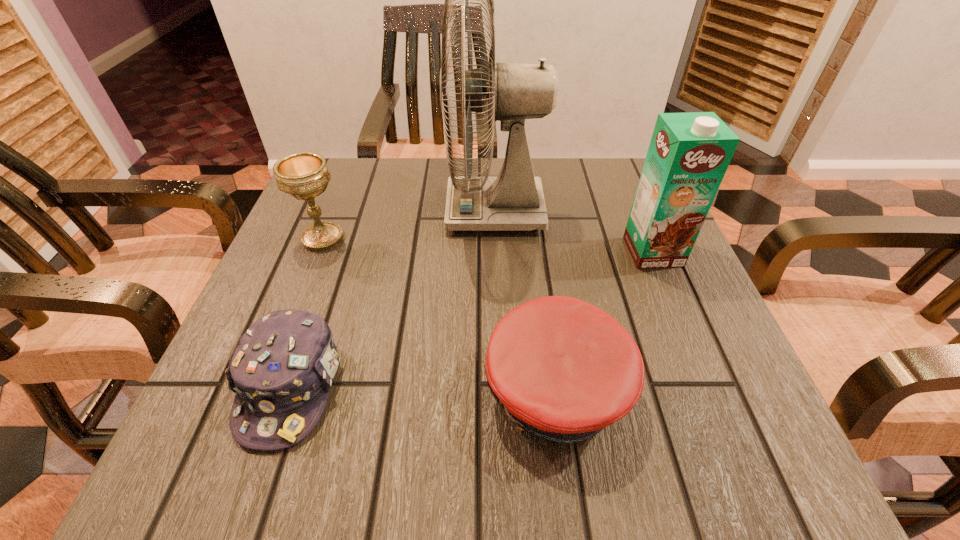
Locate an element on the screen. vacant space located 0.070m on the right of the third tallest object is located at coordinates (382, 238).

I want to click on free space located on the front-facing side of the right headwear, so click(x=275, y=390).

I want to click on vacant area situated on the front-facing side of the right headwear, so click(288, 390).

Where is `vacant space located 0.230m on the front-facing side of the right headwear`? Image resolution: width=960 pixels, height=540 pixels. vacant space located 0.230m on the front-facing side of the right headwear is located at coordinates (328, 390).

Image resolution: width=960 pixels, height=540 pixels. Identify the location of object that is positioned at the far edge. (513, 201).

Identify the location of chalice present at the left edge. Image resolution: width=960 pixels, height=540 pixels. (303, 175).

At what (x,y) coordinates should I click in order to perform the action: click on headwear that is at the left edge. Please return your answer as a coordinate pair (x, y). Looking at the image, I should click on (281, 371).

This screenshot has width=960, height=540. In order to click on object positioned at the right edge in this screenshot , I will do `click(689, 153)`.

Where is `object at the near left corner`? object at the near left corner is located at coordinates (281, 371).

Identify the location of vacant space at the far edge of the desktop. This screenshot has height=540, width=960. (418, 217).